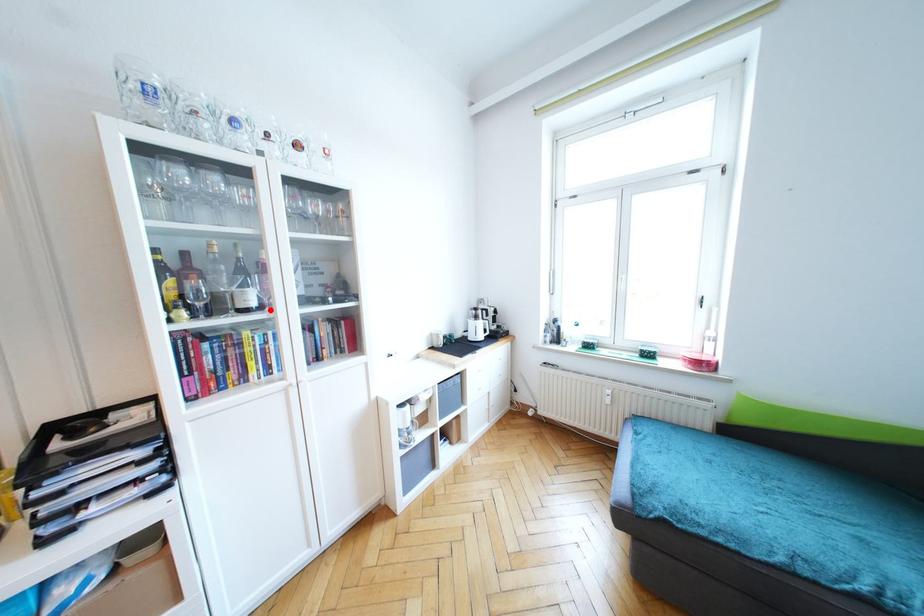
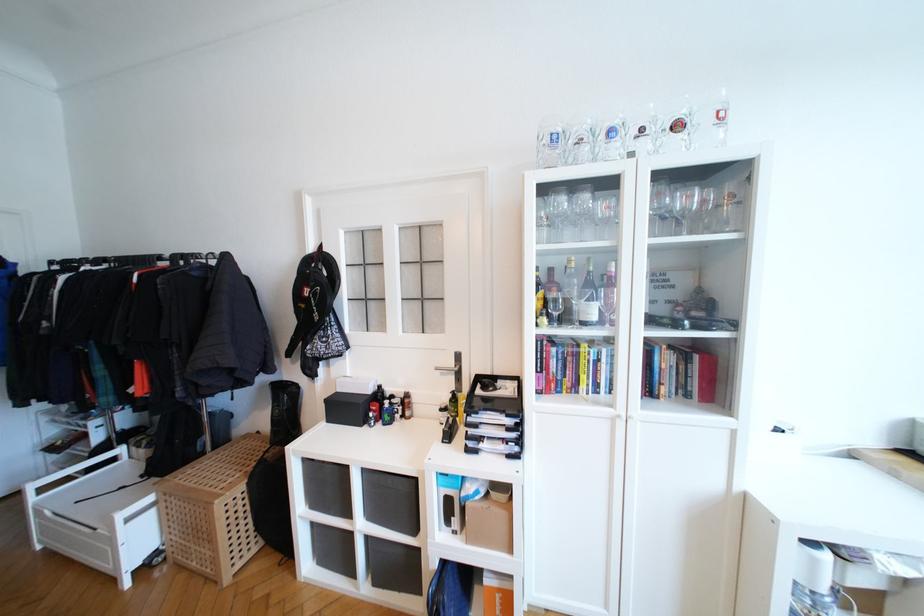
Where in the second image is the point corresponding to the highlighted location from the first image?

(611, 326)